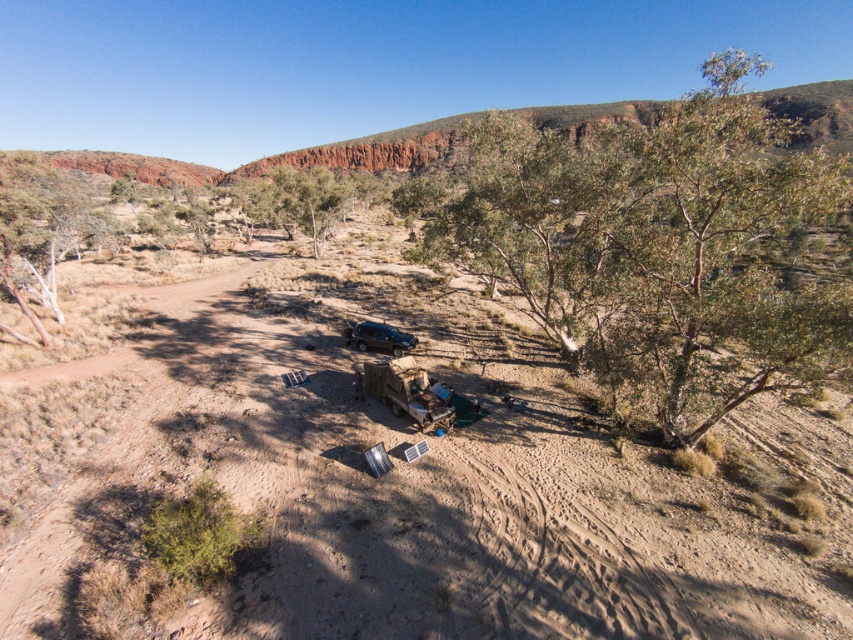
Who is positioned more to the right, brown sandy dirt field at center or matte black jeep at center?

From the viewer's perspective, matte black jeep at center appears more on the right side.

Does brown sandy dirt field at center have a lesser width compared to matte black jeep at center?

Incorrect, brown sandy dirt field at center's width is not less than matte black jeep at center's.

At what (x,y) coordinates should I click in order to perform the action: click on brown sandy dirt field at center. Please return your answer as a coordinate pair (x, y). Looking at the image, I should click on (389, 474).

Locate an element on the screen. brown sandy dirt field at center is located at coordinates (389, 474).

Who is positioned more to the right, green leafy tree at center or matte black jeep at center?

green leafy tree at center is more to the right.

Who is taller, green leafy tree at center or matte black jeep at center?

green leafy tree at center is taller.

Is point (599, 296) less distant than point (376, 323)?

Yes, point (599, 296) is closer to viewer.

This screenshot has width=853, height=640. I want to click on green leafy tree at center, so click(x=660, y=248).

Does brown sandy dirt field at center have a lesser height compared to green leafy tree at center?

Yes, brown sandy dirt field at center is shorter than green leafy tree at center.

Who is lower down, brown sandy dirt field at center or green leafy tree at center?

brown sandy dirt field at center is below.

Who is more forward, (119,605) or (657,116)?

Point (119,605)

Locate an element on the screen. This screenshot has width=853, height=640. brown sandy dirt field at center is located at coordinates (389, 474).